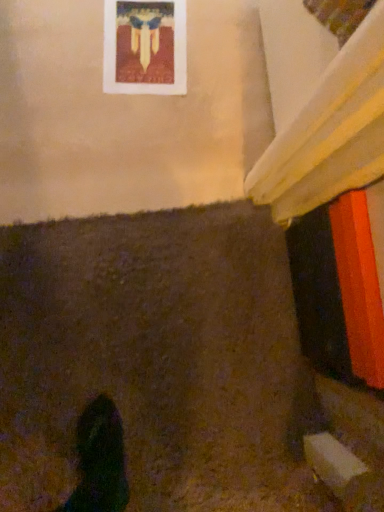
Where is `matte paper picture frame at upper center`? This screenshot has height=512, width=384. matte paper picture frame at upper center is located at coordinates (145, 47).

This screenshot has height=512, width=384. Describe the element at coordinates (145, 47) in the screenshot. I see `matte paper picture frame at upper center` at that location.

The width and height of the screenshot is (384, 512). I want to click on matte paper picture frame at upper center, so click(145, 47).